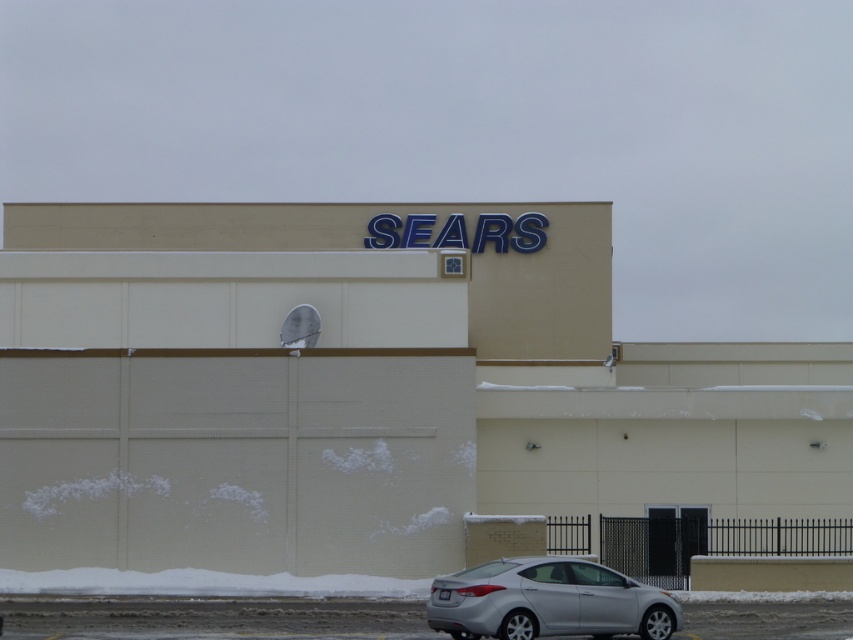
Question: Is silver metallic car at lower center wider than silver metallic sedan at lower center?

Choices:
 (A) yes
 (B) no

Answer: (A)

Question: Can you confirm if beige/matte building at center is bigger than silver metallic sedan at lower center?

Choices:
 (A) yes
 (B) no

Answer: (A)

Question: Which point is closer to the camera taking this photo?

Choices:
 (A) (341, 620)
 (B) (500, 568)
 (C) (32, 256)

Answer: (B)

Question: Does beige/matte building at center have a larger size compared to silver metallic sedan at lower center?

Choices:
 (A) no
 (B) yes

Answer: (B)

Question: Based on their relative distances, which object is nearer to the beige/matte building at center?

Choices:
 (A) silver metallic car at lower center
 (B) silver metallic sedan at lower center

Answer: (A)

Question: Which point appears closest to the camera in this image?

Choices:
 (A) (425, 612)
 (B) (122, 378)
 (C) (283, 625)

Answer: (C)